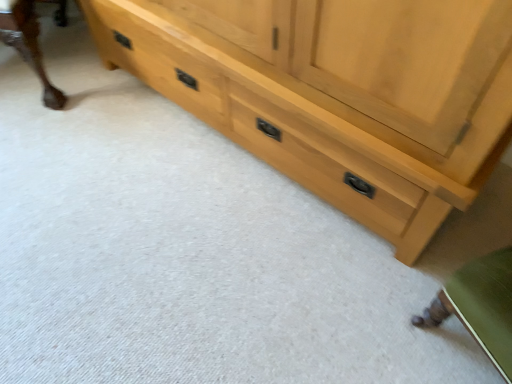
You are a GUI agent. You are given a task and a screenshot of the screen. Output one action in this format:
    pyautogui.click(x=<x>, y=<y>)
    Task: Click on the natural wood chest of drawers at center
    
    Given the screenshot: What is the action you would take?
    pyautogui.click(x=308, y=122)

Describe the element at coordinates (308, 122) in the screenshot. I see `natural wood chest of drawers at center` at that location.

Locate an element on the screen. This screenshot has height=384, width=512. natural wood chest of drawers at center is located at coordinates (308, 122).